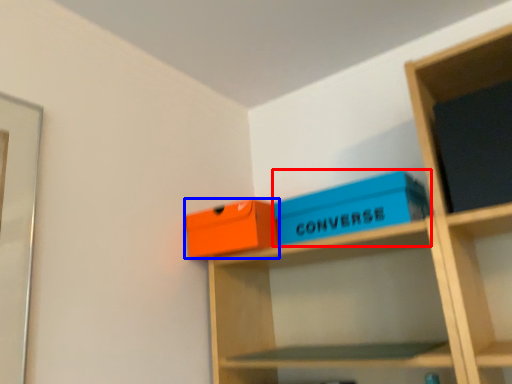
Question: Which object is closer to the camera taking this photo, box (highlighted by a red box) or box (highlighted by a blue box)?

Choices:
 (A) box
 (B) box

Answer: (A)